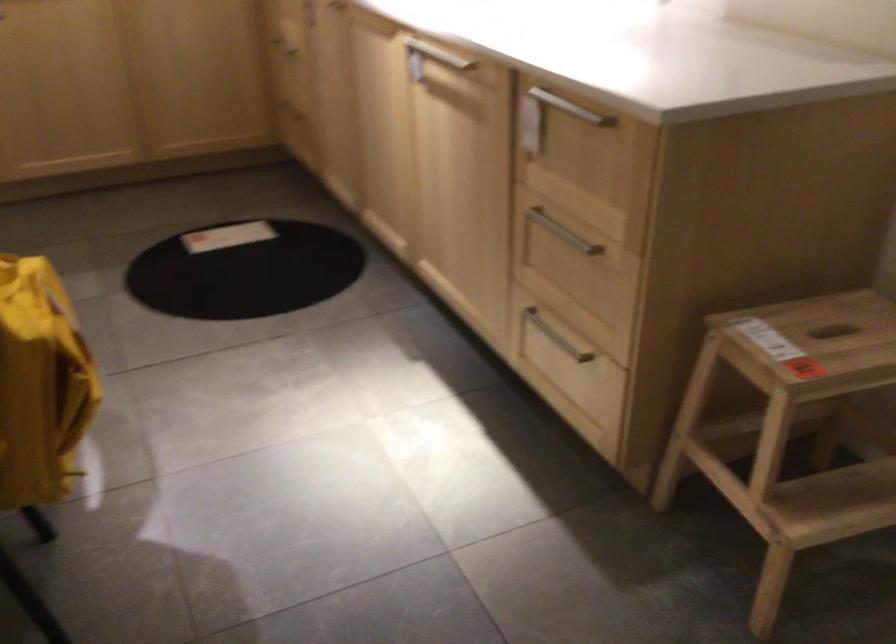
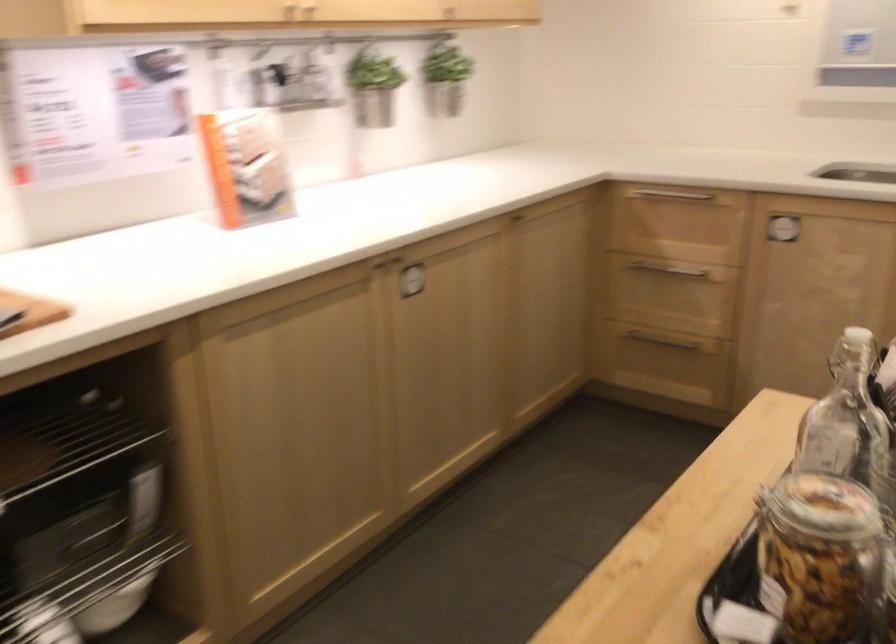
What movement of the cameraman would produce the second image?

The cameraman moved toward left, forward.